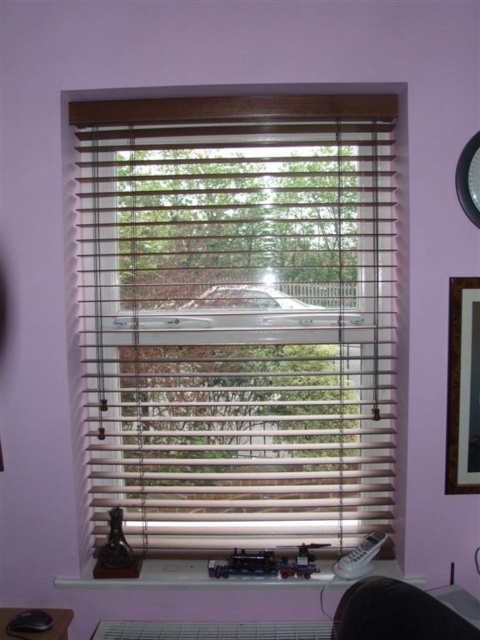
From the picture: Between wooden picture frame at right and black plastic mouse at lower left, which one appears on the right side from the viewer's perspective?

From the viewer's perspective, wooden picture frame at right appears more on the right side.

This screenshot has width=480, height=640. What do you see at coordinates (463, 387) in the screenshot?
I see `wooden picture frame at right` at bounding box center [463, 387].

Is point (463, 346) less distant than point (32, 636)?

That is False.

I want to click on wooden picture frame at right, so click(x=463, y=387).

Who is shorter, wooden blinds at center or metallic clock at upper right?

metallic clock at upper right

Does wooden blinds at center have a lesser width compared to metallic clock at upper right?

No.

This screenshot has height=640, width=480. Describe the element at coordinates (238, 317) in the screenshot. I see `wooden blinds at center` at that location.

At what (x,y) coordinates should I click in order to perform the action: click on wooden blinds at center. Please return your answer as a coordinate pair (x, y). The width and height of the screenshot is (480, 640). Looking at the image, I should click on (238, 317).

Who is more distant from viewer, (459, 349) or (472, 141)?

The point (459, 349) is behind.

In the scene shown: Between wooden picture frame at right and metallic clock at upper right, which one is positioned lower?

wooden picture frame at right

Does point (451, 348) lie in front of point (456, 189)?

No, (451, 348) is behind (456, 189).

The width and height of the screenshot is (480, 640). I want to click on wooden picture frame at right, so click(463, 387).